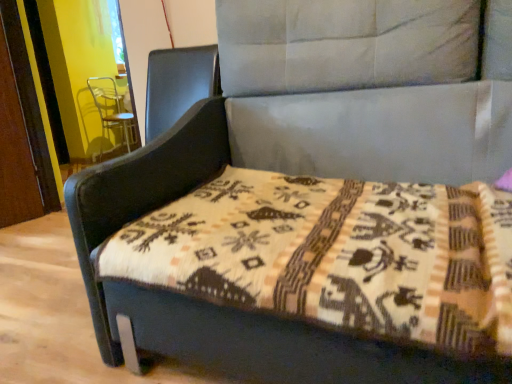
Question: Can you confirm if beige woven mattress at center is taller than metallic silver swivel chair at upper left?

Choices:
 (A) no
 (B) yes

Answer: (A)

Question: Does beige woven mattress at center appear on the right side of metallic silver swivel chair at upper left?

Choices:
 (A) no
 (B) yes

Answer: (B)

Question: Does beige woven mattress at center have a greater width compared to metallic silver swivel chair at upper left?

Choices:
 (A) no
 (B) yes

Answer: (B)

Question: From the image's perspective, is beige woven mattress at center located above metallic silver swivel chair at upper left?

Choices:
 (A) yes
 (B) no

Answer: (B)

Question: Would you say beige woven mattress at center is a long distance from metallic silver swivel chair at upper left?

Choices:
 (A) no
 (B) yes

Answer: (B)

Question: Can you confirm if beige woven mattress at center is bigger than metallic silver swivel chair at upper left?

Choices:
 (A) no
 (B) yes

Answer: (A)

Question: Is metallic silver swivel chair at upper left far away from beige woven mattress at center?

Choices:
 (A) yes
 (B) no

Answer: (A)

Question: Is metallic silver swivel chair at upper left bigger than beige woven mattress at center?

Choices:
 (A) yes
 (B) no

Answer: (A)

Question: Can you confirm if metallic silver swivel chair at upper left is smaller than beige woven mattress at center?

Choices:
 (A) no
 (B) yes

Answer: (A)

Question: Is metallic silver swivel chair at upper left looking in the opposite direction of beige woven mattress at center?

Choices:
 (A) yes
 (B) no

Answer: (B)

Question: Is metallic silver swivel chair at upper left at the right side of beige woven mattress at center?

Choices:
 (A) yes
 (B) no

Answer: (B)

Question: Does metallic silver swivel chair at upper left have a lesser width compared to beige woven mattress at center?

Choices:
 (A) yes
 (B) no

Answer: (A)

Question: Is point (110, 84) positioned closer to the camera than point (413, 198)?

Choices:
 (A) farther
 (B) closer

Answer: (A)